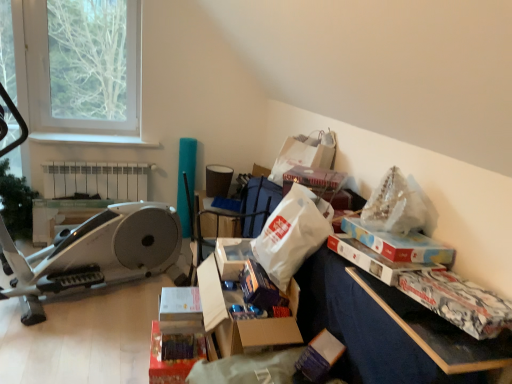
The width and height of the screenshot is (512, 384). Describe the element at coordinates (242, 320) in the screenshot. I see `cardboard box at center, arranged as the 2th storage box when ordered from the bottom` at that location.

Find the location of `white matte paper bag at center, the second paper bag positioned from the back`. white matte paper bag at center, the second paper bag positioned from the back is located at coordinates (292, 234).

Describe the element at coordinates (396, 205) in the screenshot. I see `translucent plastic bag at upper right, which is the first paper bag from front to back` at that location.

Where is `cardboard box at center, arranged as the first storage box when viewed from the top`? The image size is (512, 384). cardboard box at center, arranged as the first storage box when viewed from the top is located at coordinates (242, 320).

Does translucent plastic bag at upper right, the third paper bag when ordered from back to front, appear on the right side of cardboard box at center, arranged as the first storage box when viewed from the top?

Yes.

In the scene shown: Is translucent plastic bag at upper right, which is the first paper bag from front to back, bigger or smaller than cardboard box at center, arranged as the first storage box when viewed from the top?

In the image, translucent plastic bag at upper right, which is the first paper bag from front to back, appears to be smaller than cardboard box at center, arranged as the first storage box when viewed from the top.

Could you tell me if translucent plastic bag at upper right, the third paper bag when ordered from back to front, is facing cardboard box at center, marked as the 2th storage box in a left-to-right arrangement?

No, translucent plastic bag at upper right, the third paper bag when ordered from back to front, is not turned towards cardboard box at center, marked as the 2th storage box in a left-to-right arrangement.

In the image, is white plastic radiator at upper left positioned in front of or behind matte cardboard storage box at center, which is the 2th storage box from top to bottom?

Clearly, white plastic radiator at upper left is behind matte cardboard storage box at center, which is the 2th storage box from top to bottom.

Considering the sizes of white plastic radiator at upper left and matte cardboard storage box at center, acting as the 1th storage box starting from the bottom, in the image, is white plastic radiator at upper left taller or shorter than matte cardboard storage box at center, acting as the 1th storage box starting from the bottom,?

Considering their sizes, white plastic radiator at upper left has more height than matte cardboard storage box at center, acting as the 1th storage box starting from the bottom.

Considering the relative positions of translucent plastic bag at upper right, the third paper bag when ordered from back to front, and matte cardboard storage box at center, acting as the 1th storage box starting from the bottom, in the image provided, is translucent plastic bag at upper right, the third paper bag when ordered from back to front, to the left of matte cardboard storage box at center, acting as the 1th storage box starting from the bottom, from the viewer's perspective?

No, translucent plastic bag at upper right, the third paper bag when ordered from back to front, is not to the left of matte cardboard storage box at center, acting as the 1th storage box starting from the bottom.

Based on the photo, is matte cardboard storage box at center, which is counted as the 2th storage box, starting from the right, surrounded by translucent plastic bag at upper right, which is the first paper bag from front to back?

No, translucent plastic bag at upper right, which is the first paper bag from front to back, does not contain matte cardboard storage box at center, which is counted as the 2th storage box, starting from the right.

Locate an element on the screen. The width and height of the screenshot is (512, 384). paper bag that is the 3rd object to the right of the matte cardboard storage box at center, acting as the 1th storage box starting from the bottom, starting at the anchor is located at coordinates (396, 205).

Between point (384, 204) and point (198, 353), which one is positioned in front?

The point (384, 204) is closer.

Based on their positions, is white matte paper bag at center, marked as the 2th paper bag in a front-to-back arrangement, located to the left or right of matte cardboard storage box at center, which is counted as the 2th storage box, starting from the right?

Clearly, white matte paper bag at center, marked as the 2th paper bag in a front-to-back arrangement, is on the right of matte cardboard storage box at center, which is counted as the 2th storage box, starting from the right, in the image.

From a real-world perspective, is white matte paper bag at center, the second paper bag positioned from the back, beneath matte cardboard storage box at center, which ranks as the first storage box in left-to-right order?

Incorrect, from a real-world perspective, white matte paper bag at center, the second paper bag positioned from the back, is higher than matte cardboard storage box at center, which ranks as the first storage box in left-to-right order.

Is white matte paper bag at center, marked as the 2th paper bag in a front-to-back arrangement, wider than matte cardboard storage box at center, acting as the 1th storage box starting from the bottom?

Correct, the width of white matte paper bag at center, marked as the 2th paper bag in a front-to-back arrangement, exceeds that of matte cardboard storage box at center, acting as the 1th storage box starting from the bottom.

Looking at their sizes, would you say white paper bag at upper center, which is the 3th paper bag from front to back, is wider or thinner than cardboard box at center, arranged as the first storage box when viewed from the top?

In the image, white paper bag at upper center, which is the 3th paper bag from front to back, appears to be more narrow than cardboard box at center, arranged as the first storage box when viewed from the top.

Which is farther, (329, 138) or (216, 255)?

Positioned behind is point (329, 138).

Does white paper bag at upper center, the first paper bag positioned from the back, turn towards cardboard box at center, marked as the 2th storage box in a left-to-right arrangement?

No, white paper bag at upper center, the first paper bag positioned from the back, is not turned towards cardboard box at center, marked as the 2th storage box in a left-to-right arrangement.

In the image, is white paper bag at upper center, which is the 3th paper bag from front to back, positioned in front of or behind cardboard box at center, arranged as the first storage box when viewed from the top?

Clearly, white paper bag at upper center, which is the 3th paper bag from front to back, is behind cardboard box at center, arranged as the first storage box when viewed from the top.

Considering the sizes of white matte paper bag at center, marked as the 2th paper bag in a front-to-back arrangement, and white plastic radiator at upper left in the image, is white matte paper bag at center, marked as the 2th paper bag in a front-to-back arrangement, bigger or smaller than white plastic radiator at upper left?

Clearly, white matte paper bag at center, marked as the 2th paper bag in a front-to-back arrangement, is smaller in size than white plastic radiator at upper left.

Does point (300, 239) appear closer or farther from the camera than point (122, 166)?

Point (300, 239) is positioned closer to the camera compared to point (122, 166).

In terms of width, does white matte paper bag at center, marked as the 2th paper bag in a front-to-back arrangement, look wider or thinner when compared to white plastic radiator at upper left?

In the image, white matte paper bag at center, marked as the 2th paper bag in a front-to-back arrangement, appears to be wider than white plastic radiator at upper left.

The width and height of the screenshot is (512, 384). Identify the location of the 1st paper bag to the right of the white plastic radiator at upper left, counting from the anchor's position. (292, 234).

Are white plastic radiator at upper left and cardboard box at center, arranged as the first storage box when viewed from the top, making contact?

No, white plastic radiator at upper left is not making contact with cardboard box at center, arranged as the first storage box when viewed from the top.

Can you confirm if white plastic radiator at upper left is taller than cardboard box at center, arranged as the first storage box when viewed from the top?

Yes, white plastic radiator at upper left is taller than cardboard box at center, arranged as the first storage box when viewed from the top.

Between white plastic radiator at upper left and cardboard box at center, arranged as the first storage box when viewed from the top, which one appears on the right side from the viewer's perspective?

From the viewer's perspective, cardboard box at center, arranged as the first storage box when viewed from the top, appears more on the right side.

Which object is wider, white plastic radiator at upper left or cardboard box at center, arranged as the first storage box when viewed from the top?

cardboard box at center, arranged as the first storage box when viewed from the top, is wider.

The height and width of the screenshot is (384, 512). Find the location of `the 1st storage box directly beneath the translucent plastic bag at upper right, which is the first paper bag from front to back (from a real-world perspective)`. the 1st storage box directly beneath the translucent plastic bag at upper right, which is the first paper bag from front to back (from a real-world perspective) is located at coordinates (242, 320).

Locate an element on the screen. The width and height of the screenshot is (512, 384). the 1st storage box in front of the white plastic radiator at upper left, counting from the anchor's position is located at coordinates (172, 360).

Considering their positions, is translucent plastic bag at upper right, the third paper bag when ordered from back to front, positioned closer to white paper bag at upper center, the first paper bag positioned from the back, than white matte paper bag at center, the second paper bag positioned from the back?

white matte paper bag at center, the second paper bag positioned from the back.

Considering their positions, is matte cardboard storage box at center, which ranks as the first storage box in left-to-right order, positioned further to translucent plastic bag at upper right, which is the first paper bag from front to back, than white paper bag at upper center, the first paper bag positioned from the back?

matte cardboard storage box at center, which ranks as the first storage box in left-to-right order.

Estimate the real-world distances between objects in this image. Which object is closer to white matte paper bag at center, the second paper bag positioned from the back, translucent plastic bag at upper right, which is the first paper bag from front to back, or white plastic radiator at upper left?

Among the two, translucent plastic bag at upper right, which is the first paper bag from front to back, is located nearer to white matte paper bag at center, the second paper bag positioned from the back.

Which object lies further to the anchor point white paper bag at upper center, the first paper bag positioned from the back, white matte paper bag at center, marked as the 2th paper bag in a front-to-back arrangement, or matte cardboard storage box at center, which is the 2th storage box from top to bottom?

Based on the image, matte cardboard storage box at center, which is the 2th storage box from top to bottom, appears to be further to white paper bag at upper center, the first paper bag positioned from the back.

Looking at the image, which one is located closer to white matte paper bag at center, the second paper bag positioned from the back, translucent plastic bag at upper right, the third paper bag when ordered from back to front, or matte cardboard storage box at center, which is counted as the 2th storage box, starting from the right?

translucent plastic bag at upper right, the third paper bag when ordered from back to front, lies closer to white matte paper bag at center, the second paper bag positioned from the back, than the other object.

When comparing their distances from cardboard box at center, the 1th storage box when ordered from right to left, does matte cardboard storage box at center, which ranks as the first storage box in left-to-right order, or white matte paper bag at center, the second paper bag positioned from the back, seem further?

Among the two, matte cardboard storage box at center, which ranks as the first storage box in left-to-right order, is located further to cardboard box at center, the 1th storage box when ordered from right to left.

From the picture: Based on their spatial positions, is translucent plastic bag at upper right, which is the first paper bag from front to back, or white plastic radiator at upper left further from white paper bag at upper center, the first paper bag positioned from the back?

Among the two, white plastic radiator at upper left is located further to white paper bag at upper center, the first paper bag positioned from the back.

Considering their positions, is cardboard box at center, arranged as the 2th storage box when ordered from the bottom, positioned further to white paper bag at upper center, the first paper bag positioned from the back, than matte cardboard storage box at center, acting as the 1th storage box starting from the bottom?

matte cardboard storage box at center, acting as the 1th storage box starting from the bottom, is positioned further to the anchor white paper bag at upper center, the first paper bag positioned from the back.

Where is `storage box between cardboard box at center, arranged as the 2th storage box when ordered from the bottom, and white plastic radiator at upper left, along the z-axis`? The image size is (512, 384). storage box between cardboard box at center, arranged as the 2th storage box when ordered from the bottom, and white plastic radiator at upper left, along the z-axis is located at coordinates (172, 360).

The image size is (512, 384). What are the coordinates of `storage box between white matte paper bag at center, the second paper bag positioned from the back, and matte cardboard storage box at center, which is counted as the 2th storage box, starting from the right, in the up-down direction` in the screenshot? It's located at pyautogui.click(x=242, y=320).

Locate an element on the screen. The width and height of the screenshot is (512, 384). paper bag positioned between translucent plastic bag at upper right, the third paper bag when ordered from back to front, and white paper bag at upper center, the first paper bag positioned from the back, from near to far is located at coordinates (292, 234).

Identify the location of paper bag between white plastic radiator at upper left and white paper bag at upper center, which is the 3th paper bag from front to back, in the horizontal direction. This screenshot has height=384, width=512. (292, 234).